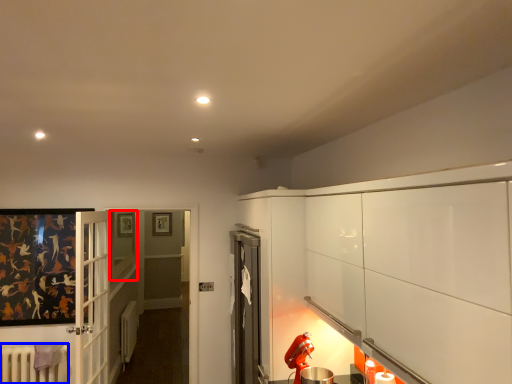
Question: Which of the following is the farthest to the observer, window (highlighted by a red box) or radiator (highlighted by a blue box)?

Choices:
 (A) window
 (B) radiator

Answer: (A)